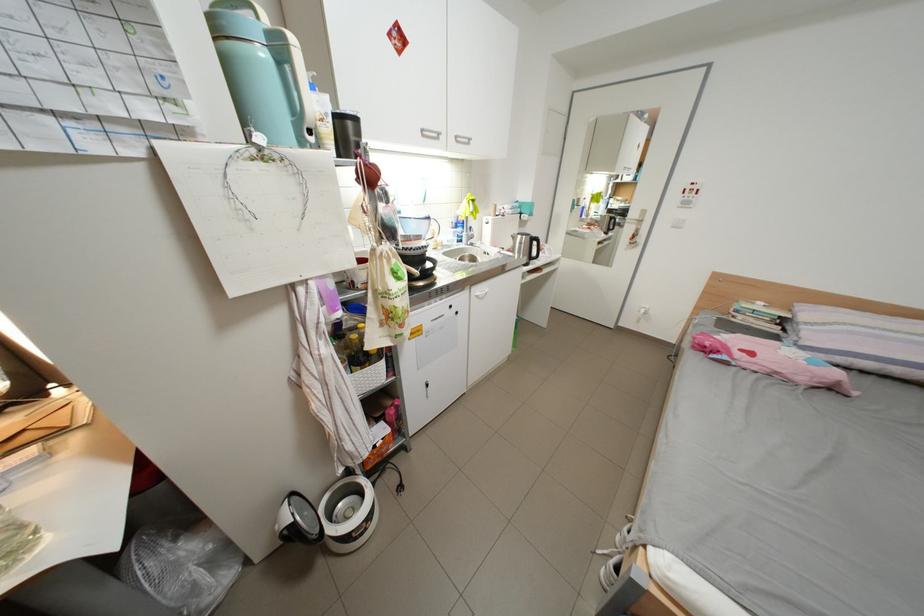
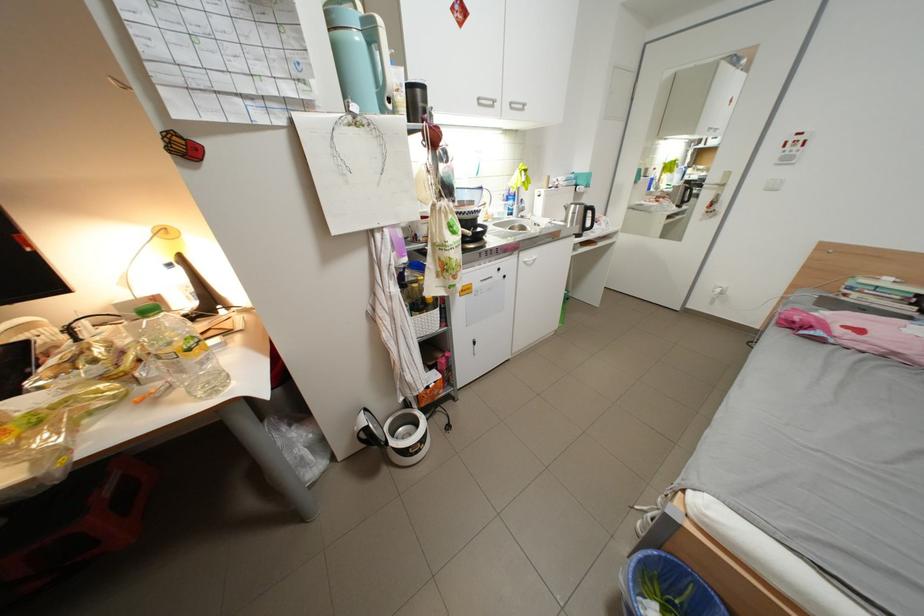
Where in the second image is the point corresponding to the point at 532,245 from the first image?

(585, 215)